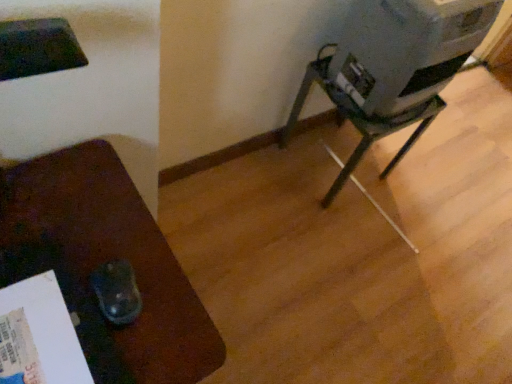
Question: From the image's perspective, is metallic gray water cooler at right over matte brown mouse pad at left, the first furniture viewed from the left?

Choices:
 (A) yes
 (B) no

Answer: (A)

Question: From a real-world perspective, does metallic gray water cooler at right stand above matte brown mouse pad at left, which is the second furniture in right-to-left order?

Choices:
 (A) yes
 (B) no

Answer: (A)

Question: Can you confirm if metallic gray water cooler at right is bigger than matte brown mouse pad at left, which is the 2th furniture in top-to-bottom order?

Choices:
 (A) yes
 (B) no

Answer: (B)

Question: Is metallic gray water cooler at right located outside matte brown mouse pad at left, acting as the first furniture starting from the bottom?

Choices:
 (A) yes
 (B) no

Answer: (A)

Question: Considering the relative positions of metallic gray water cooler at right and matte brown mouse pad at left, acting as the first furniture starting from the bottom, in the image provided, is metallic gray water cooler at right to the right of matte brown mouse pad at left, acting as the first furniture starting from the bottom, from the viewer's perspective?

Choices:
 (A) no
 (B) yes

Answer: (B)

Question: Is metallic gray water cooler at right in contact with matte brown mouse pad at left, acting as the first furniture starting from the bottom?

Choices:
 (A) yes
 (B) no

Answer: (B)

Question: Does metallic gray projector at center-right, arranged as the 1th furniture when viewed from the right, lie behind metallic gray water cooler at right?

Choices:
 (A) no
 (B) yes

Answer: (B)

Question: From the image's perspective, is metallic gray projector at center-right, which ranks as the second furniture in front-to-back order, under metallic gray water cooler at right?

Choices:
 (A) yes
 (B) no

Answer: (A)

Question: Can you confirm if metallic gray projector at center-right, the 2th furniture in the left-to-right sequence, is wider than metallic gray water cooler at right?

Choices:
 (A) yes
 (B) no

Answer: (A)

Question: Considering the relative sizes of metallic gray projector at center-right, the 2th furniture in the left-to-right sequence, and metallic gray water cooler at right in the image provided, is metallic gray projector at center-right, the 2th furniture in the left-to-right sequence, taller than metallic gray water cooler at right?

Choices:
 (A) no
 (B) yes

Answer: (B)

Question: Is metallic gray projector at center-right, the 2th furniture in the left-to-right sequence, far away from metallic gray water cooler at right?

Choices:
 (A) no
 (B) yes

Answer: (A)

Question: Can you confirm if metallic gray projector at center-right, which ranks as the first furniture in back-to-front order, is bigger than metallic gray water cooler at right?

Choices:
 (A) no
 (B) yes

Answer: (B)

Question: Is metallic gray projector at center-right, which ranks as the second furniture in front-to-back order, oriented away from matte brown mouse pad at left, which is the 2th furniture in top-to-bottom order?

Choices:
 (A) no
 (B) yes

Answer: (A)